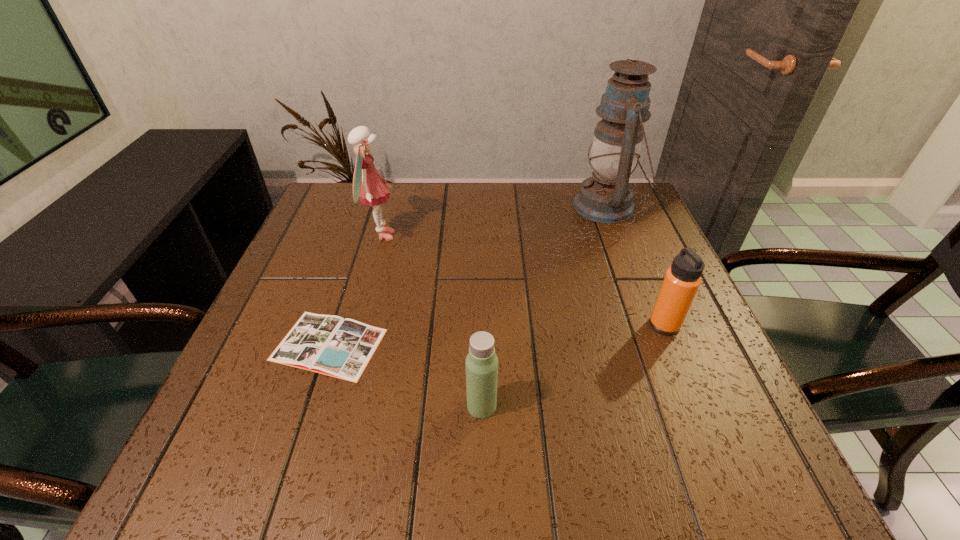
Identify the location of free space located 0.080m on the back of the book. Image resolution: width=960 pixels, height=540 pixels. (348, 286).

Find the location of a particular element. Image resolution: width=960 pixels, height=540 pixels. oil lamp located at the far edge is located at coordinates (607, 197).

Locate an element on the screen. This screenshot has height=540, width=960. doll positioned at the far edge is located at coordinates (368, 184).

Find the location of a particular element. The height and width of the screenshot is (540, 960). doll at the left edge is located at coordinates (368, 184).

Locate an element on the screen. Image resolution: width=960 pixels, height=540 pixels. book that is positioned at the left edge is located at coordinates (327, 344).

The width and height of the screenshot is (960, 540). Find the location of `oil lamp that is positioned at the right edge`. oil lamp that is positioned at the right edge is located at coordinates (607, 197).

You are a GUI agent. You are given a task and a screenshot of the screen. Output one action in this format:
    pyautogui.click(x=<x>, y=<y>)
    Task: Click on the thermos bottle located in the right edge section of the desktop
    The height and width of the screenshot is (540, 960).
    Given the screenshot: What is the action you would take?
    pyautogui.click(x=682, y=280)

Identify the location of object situated at the far left corner. (368, 184).

I want to click on object at the far right corner, so click(x=607, y=197).

In order to click on free space at the far edge of the desktop in this screenshot , I will do `click(515, 207)`.